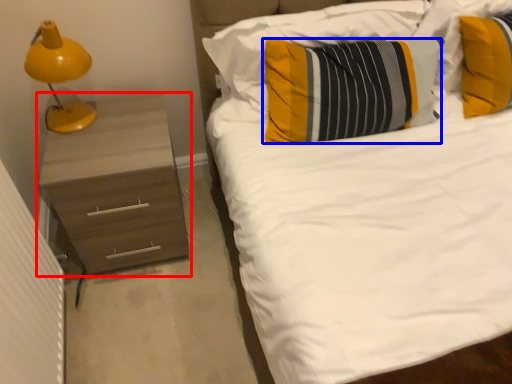
Question: Which point is further to the camera, chest of drawers (highlighted by a red box) or pillow (highlighted by a blue box)?

Choices:
 (A) chest of drawers
 (B) pillow

Answer: (A)